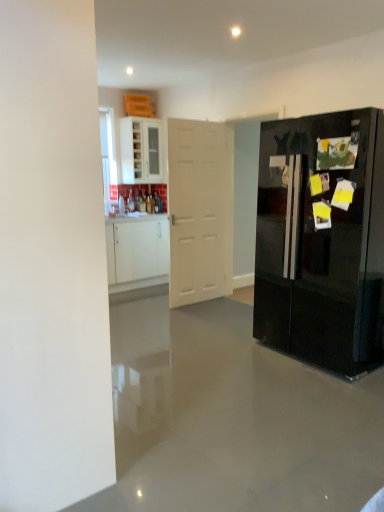
The height and width of the screenshot is (512, 384). Find the location of `white glossy cabinet at upper left`. white glossy cabinet at upper left is located at coordinates (141, 150).

Can you confirm if glossy black refrigerator at right is positioned to the left of white matte door at center?

In fact, glossy black refrigerator at right is to the right of white matte door at center.

Consider the image. Could white matte door at center be considered to be inside glossy black refrigerator at right?

No, white matte door at center is not surrounded by glossy black refrigerator at right.

Based on the photo, who is more distant, glossy black refrigerator at right or white matte door at center?

white matte door at center is behind.

Is point (307, 255) closer or farther from the camera than point (199, 274)?

Point (307, 255).

From the picture: Would you consider white matte door at center to be distant from glossy black refrigerator at right?

white matte door at center is far away from glossy black refrigerator at right.

Is white matte door at center positioned with its back to glossy black refrigerator at right?

white matte door at center is not turned away from glossy black refrigerator at right.

How much distance is there between white matte door at center and glossy black refrigerator at right?

A distance of 1.53 meters exists between white matte door at center and glossy black refrigerator at right.

Is white matte door at center thinner than glossy black refrigerator at right?

Yes.

Is white glossy cabinet at upper left oriented away from glossy black refrigerator at right?

No, white glossy cabinet at upper left is not facing the opposite direction of glossy black refrigerator at right.

From a real-world perspective, is white glossy cabinet at upper left physically located above or below glossy black refrigerator at right?

From a real-world perspective, white glossy cabinet at upper left is physically above glossy black refrigerator at right.

From the image's perspective, would you say white glossy cabinet at upper left is shown under glossy black refrigerator at right?

No, from the image's perspective, white glossy cabinet at upper left is not beneath glossy black refrigerator at right.

Find the location of `cabinetry behind the glossy black refrigerator at right`. cabinetry behind the glossy black refrigerator at right is located at coordinates (141, 150).

Between point (195, 271) and point (162, 166), which one is positioned in front?

Point (195, 271)

Does white matte door at center appear on the left side of white glossy cabinet at upper left?

Incorrect, white matte door at center is not on the left side of white glossy cabinet at upper left.

Which of these two, white matte door at center or white glossy cabinet at upper left, is thinner?

With smaller width is white matte door at center.

Between white matte door at center and white glossy cabinet at upper left, which one has smaller size?

white glossy cabinet at upper left.

Are white glossy cabinet at upper left and white matte door at center beside each other?

No, white glossy cabinet at upper left is not next to white matte door at center.

Is white glossy cabinet at upper left wider than white matte door at center?

Answer: Indeed, white glossy cabinet at upper left has a greater width compared to white matte door at center.

Is point (129, 137) closer to camera compared to point (194, 230)?

No, (129, 137) is further to viewer.

From a real-world perspective, which object stands above the other?

white glossy cabinet at upper left, from a real-world perspective.

Is glossy black refrigerator at right wider or thinner than white glossy cabinet at upper left?

Considering their sizes, glossy black refrigerator at right looks broader than white glossy cabinet at upper left.

Can you confirm if glossy black refrigerator at right is positioned to the right of white glossy cabinet at upper left?

Indeed, glossy black refrigerator at right is positioned on the right side of white glossy cabinet at upper left.

Could you tell me if glossy black refrigerator at right is turned towards white glossy cabinet at upper left?

No, glossy black refrigerator at right is not facing towards white glossy cabinet at upper left.

This screenshot has width=384, height=512. In order to click on refrigerator below the white matte door at center (from the image's perspective) in this screenshot , I will do `click(322, 240)`.

In order to click on door above the glossy black refrigerator at right (from the image's perspective) in this screenshot , I will do `click(200, 210)`.

Looking at the image, which one is located further to white matte door at center, white glossy cabinet at upper left or glossy black refrigerator at right?

white glossy cabinet at upper left.

Estimate the real-world distances between objects in this image. Which object is closer to glossy black refrigerator at right, white glossy cabinet at upper left or white matte door at center?

white matte door at center is positioned closer to the anchor glossy black refrigerator at right.

From the image, which object appears to be farther from white glossy cabinet at upper left, white matte door at center or glossy black refrigerator at right?

glossy black refrigerator at right is positioned further to the anchor white glossy cabinet at upper left.

Considering their positions, is glossy black refrigerator at right positioned closer to white glossy cabinet at upper left than white matte door at center?

white matte door at center.

In the scene shown: Based on their spatial positions, is white matte door at center or white glossy cabinet at upper left closer to glossy black refrigerator at right?

white matte door at center is positioned closer to the anchor glossy black refrigerator at right.

Considering their positions, is glossy black refrigerator at right positioned further to white matte door at center than white glossy cabinet at upper left?

The object further to white matte door at center is white glossy cabinet at upper left.

Locate an element on the screen. The image size is (384, 512). door between glossy black refrigerator at right and white glossy cabinet at upper left from front to back is located at coordinates (200, 210).